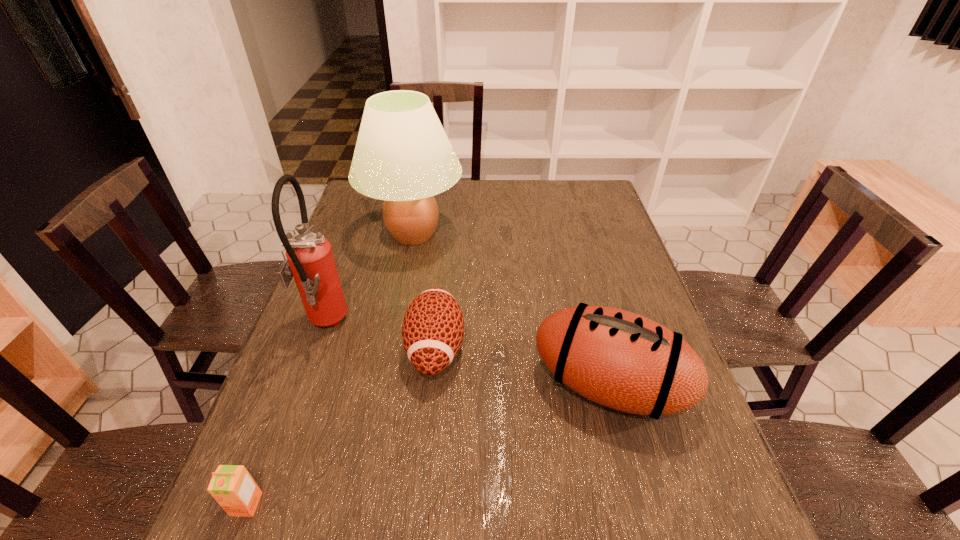
The image size is (960, 540). Identify the location of vacant space that satisfies the following two spatial constraints: 1. at the nozzle of the fire extinguisher; 2. on the front side of the shortest object. (259, 504).

What are the coordinates of `blank area in the image that satisfies the following two spatial constraints: 1. at the nozzle of the taller football; 2. on the right side of the fire extinguisher` in the screenshot? It's located at (302, 386).

You are a GUI agent. You are given a task and a screenshot of the screen. Output one action in this format:
    pyautogui.click(x=<x>, y=<y>)
    Task: Click on the vacant space that satisfies the following two spatial constraints: 1. at the nozzle of the left football; 2. on the right side of the fire extinguisher
    Image resolution: width=960 pixels, height=540 pixels.
    Given the screenshot: What is the action you would take?
    pyautogui.click(x=316, y=348)